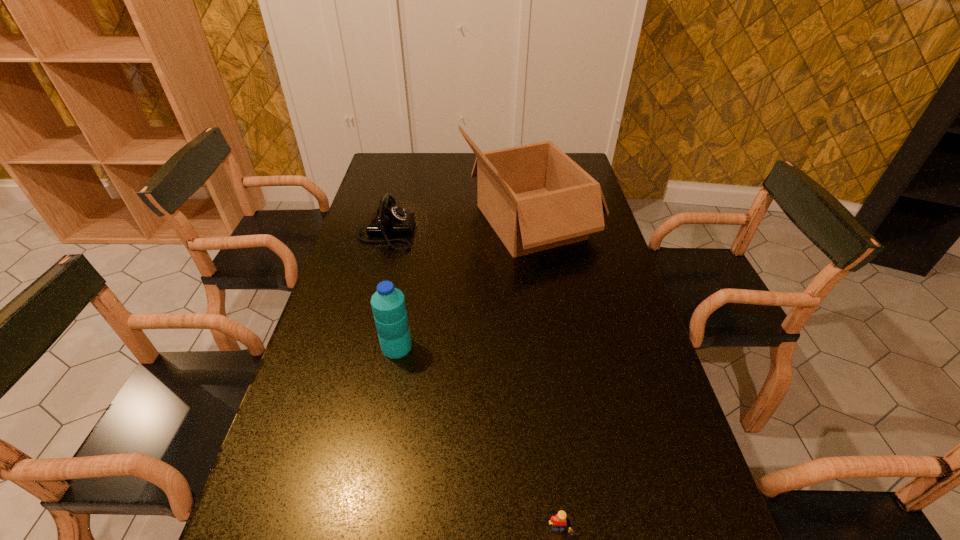
You are a GUI agent. You are given a task and a screenshot of the screen. Output one action in this format:
    pyautogui.click(x=<x>, y=<y>)
    Task: Click on the free region that satisfies the following two spatial constraints: 1. on the dial of the second tallest object; 2. on the left side of the second shortest object
    
    Given the screenshot: What is the action you would take?
    coord(356,347)

At what (x,y) coordinates should I click in order to perform the action: click on vacant space that satisfies the following two spatial constraints: 1. on the dial of the second shortest object; 2. on the left side of the third shortest object. Please return your answer as a coordinate pair (x, y). The image size is (960, 540). Looking at the image, I should click on (356, 347).

Where is `vacant space that satisfies the following two spatial constraints: 1. on the dial of the telephone; 2. on the left side of the second nearest object`? This screenshot has width=960, height=540. vacant space that satisfies the following two spatial constraints: 1. on the dial of the telephone; 2. on the left side of the second nearest object is located at coordinates (356, 347).